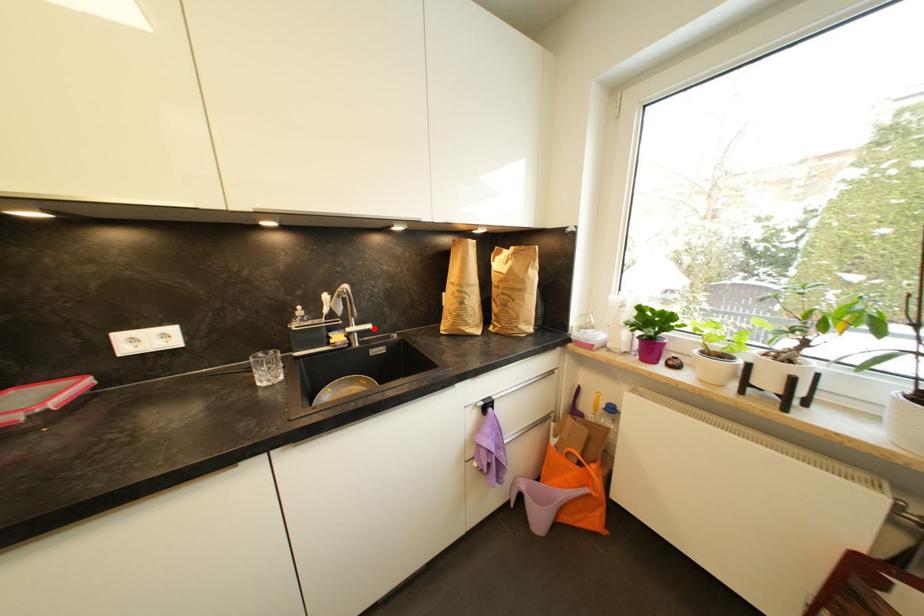
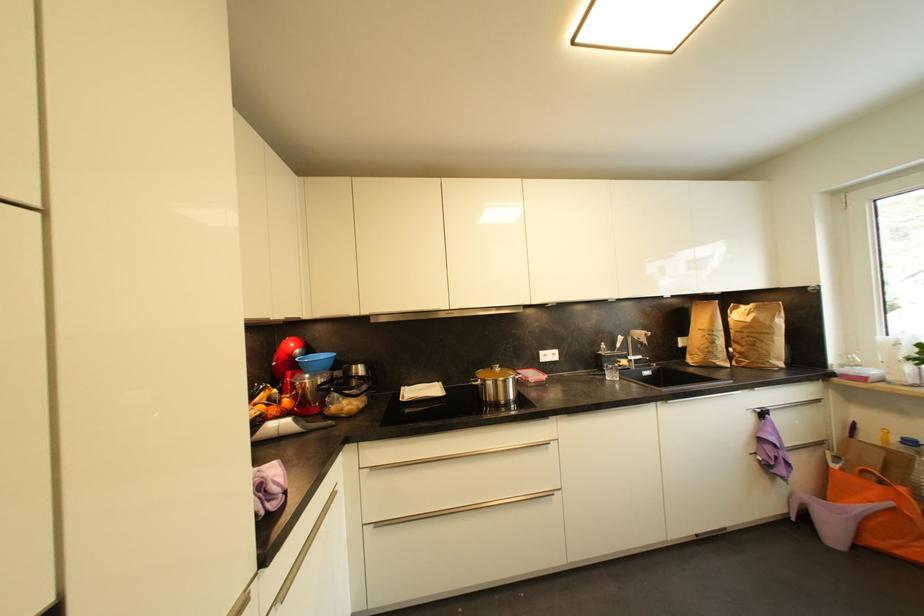
Question: I am providing you with two images of the same scene from different viewpoints. Given a red point in image1, look at the same physical point in image2. Is it:

Choices:
 (A) Closer to the viewpoint
 (B) Farther from the viewpoint

Answer: (B)